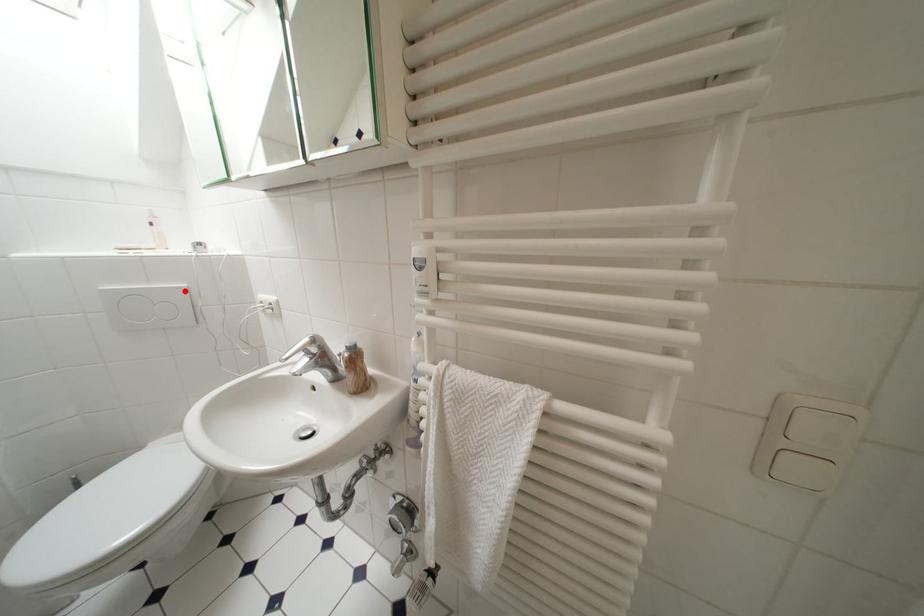
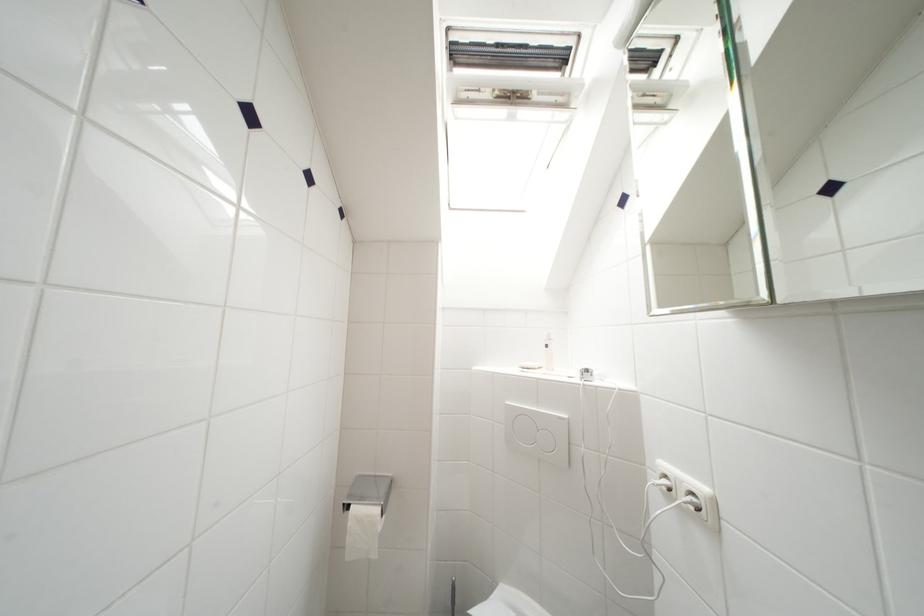
Where in the second image is the point corresponding to the highlighted location from the first image?

(565, 421)